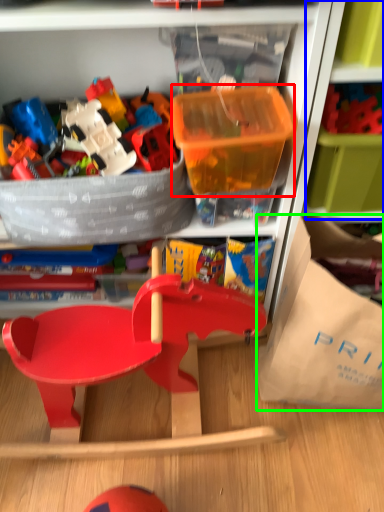
Question: Which is farther away from storage box (highlighted by a red box)? shelf (highlighted by a blue box) or paper bag (highlighted by a green box)?

Choices:
 (A) shelf
 (B) paper bag

Answer: (B)